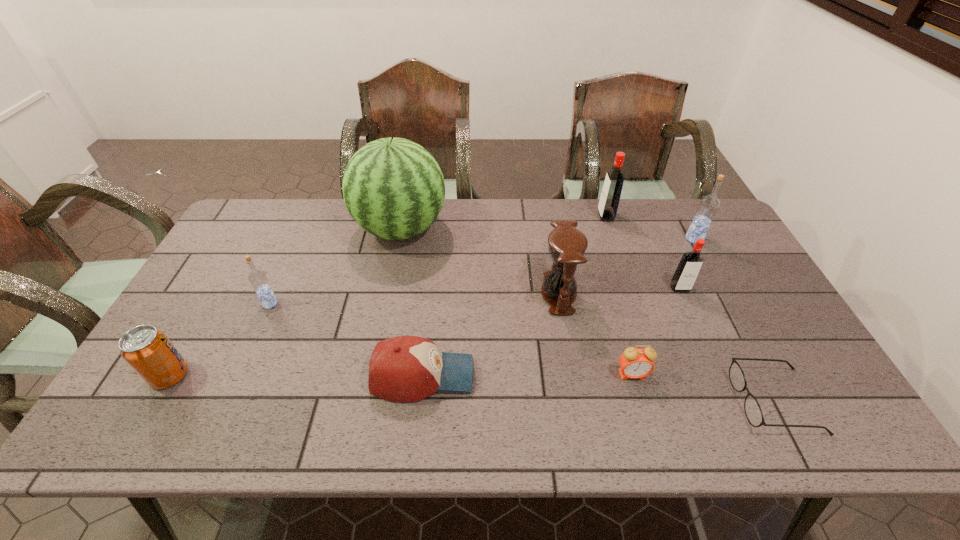
The width and height of the screenshot is (960, 540). What are the coordinates of `vacant space located 0.100m on the front and back of the second vodka from left to right` in the screenshot? It's located at (569, 216).

Locate an element on the screen. The image size is (960, 540). vacant space located on the front and back of the second vodka from left to right is located at coordinates (500, 216).

Identify the location of free spot located 0.160m on the back of the second farthest vodka. (676, 205).

Where is `vacant region located 0.110m on the right of the hourglass`? The image size is (960, 540). vacant region located 0.110m on the right of the hourglass is located at coordinates point(614,294).

Locate an element on the screen. The height and width of the screenshot is (540, 960). free space located 0.130m on the front and back of the smaller red vodka is located at coordinates (698, 328).

Locate an element on the screen. The width and height of the screenshot is (960, 540). free space located 0.130m on the right of the left blue vodka is located at coordinates (324, 303).

Locate an element on the screen. This screenshot has height=540, width=960. vacant region located 0.110m on the right of the seventh tallest object is located at coordinates (233, 375).

Find the location of `free space located on the face of the alarm clock`. free space located on the face of the alarm clock is located at coordinates (642, 411).

Find the location of `vacant space located on the front-facing side of the baseball cap`. vacant space located on the front-facing side of the baseball cap is located at coordinates (540, 375).

This screenshot has width=960, height=540. I want to click on free space located 0.100m on the front-facing side of the spectacles, so click(x=695, y=401).